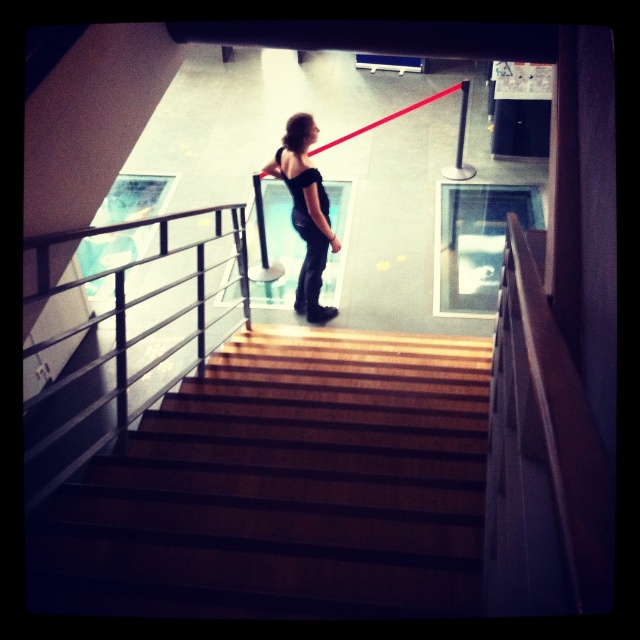
Can you confirm if metallic silver balustrade at center is positioned above black leather dress at center?

Actually, metallic silver balustrade at center is below black leather dress at center.

Between point (241, 275) and point (324, 314), which one is positioned in front?

Point (241, 275) is in front.

You are a GUI agent. You are given a task and a screenshot of the screen. Output one action in this format:
    pyautogui.click(x=<x>, y=<y>)
    Task: Click on the metallic silver balustrade at center
    Image resolution: width=640 pixels, height=640 pixels.
    Given the screenshot: What is the action you would take?
    pyautogui.click(x=120, y=346)

Is wooden stairs at center above metallic silver balustrade at center?

Incorrect, wooden stairs at center is not positioned above metallic silver balustrade at center.

Between point (259, 442) and point (145, 291), which one is positioned behind?

Positioned behind is point (145, 291).

Who is more forward, [417,468] or [218,320]?

Point [417,468]

Where is `wooden stairs at center`? This screenshot has height=640, width=640. wooden stairs at center is located at coordinates (284, 488).

Who is shorter, wooden stairs at center or black leather dress at center?

wooden stairs at center is shorter.

What do you see at coordinates (284, 488) in the screenshot?
I see `wooden stairs at center` at bounding box center [284, 488].

Is point (371, 481) positioned before point (294, 305)?

Yes, point (371, 481) is in front of point (294, 305).

The width and height of the screenshot is (640, 640). I want to click on wooden stairs at center, so click(x=284, y=488).